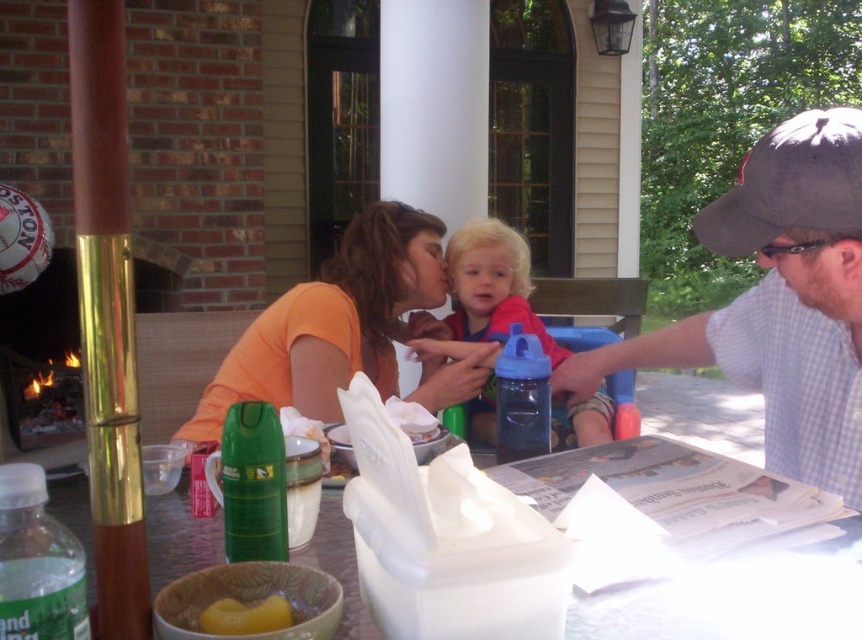
Question: Which object is the closest to the red fabric shirt at center?

Choices:
 (A) translucent plastic water bottle at lower left
 (B) green plastic spray bottle at center
 (C) blue plastic sippy cup at center
 (D) yellow matte food at lower left

Answer: (C)

Question: Which object is positioned farthest from the black fabric baseball cap at upper right?

Choices:
 (A) translucent plastic water bottle at lower left
 (B) yellow matte food at lower left

Answer: (A)

Question: Which object is closer to the camera taking this photo?

Choices:
 (A) translucent plastic table at center
 (B) black fabric baseball cap at upper right
 (C) gray checkered shirt at right

Answer: (A)

Question: Can you confirm if orange matte shirt at center is wider than yellow matte food at lower left?

Choices:
 (A) yes
 (B) no

Answer: (A)

Question: Can you confirm if black fabric baseball cap at upper right is positioned to the right of yellow matte food at lower left?

Choices:
 (A) yes
 (B) no

Answer: (A)

Question: From the image, what is the correct spatial relationship of orange matte shirt at center in relation to black fabric baseball cap at upper right?

Choices:
 (A) below
 (B) above

Answer: (A)